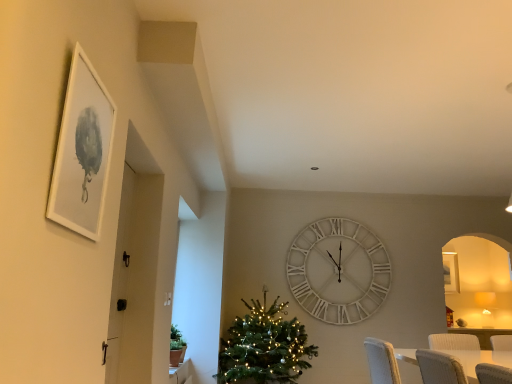
Question: From their relative heights in the image, would you say green matte christmas tree at center is taller or shorter than white wooden clock at center?

Choices:
 (A) tall
 (B) short

Answer: (B)

Question: Is green matte christmas tree at center to the left or to the right of white wooden clock at center in the image?

Choices:
 (A) right
 (B) left

Answer: (B)

Question: Which object is positioned farthest from the green matte christmas tree at center?

Choices:
 (A) white wooden clock at center
 (B) white matte picture frame at upper left

Answer: (B)

Question: Which object is the farthest from the green matte christmas tree at center?

Choices:
 (A) white matte picture frame at upper left
 (B) white wooden clock at center

Answer: (A)